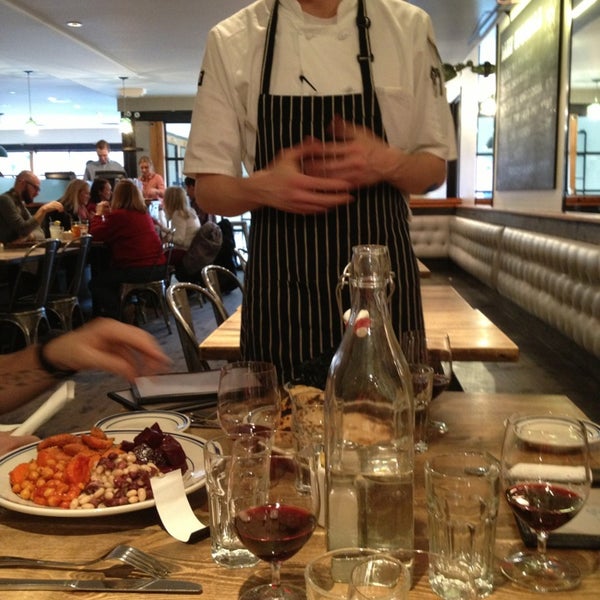
Identify the location of water glass. This screenshot has width=600, height=600. (223, 477), (314, 427), (425, 393), (458, 520), (312, 592).